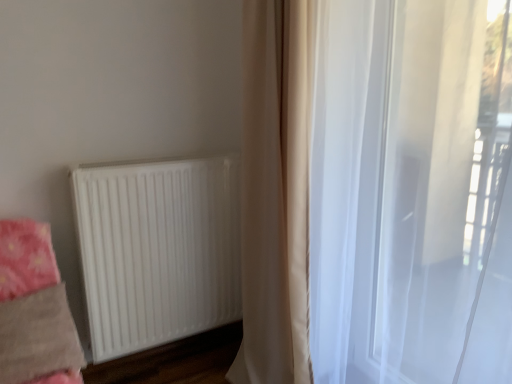
Question: From the image's perspective, is beige fabric curtain at center, placed as the 1th curtain when sorted from left to right, below translucent white curtain at right, acting as the 2th curtain starting from the left?

Choices:
 (A) yes
 (B) no

Answer: (B)

Question: Is beige fabric curtain at center, which appears as the second curtain when viewed from the right, positioned with its back to translucent white curtain at right, acting as the 2th curtain starting from the left?

Choices:
 (A) yes
 (B) no

Answer: (B)

Question: Considering the relative positions of beige fabric curtain at center, placed as the 1th curtain when sorted from left to right, and translucent white curtain at right, acting as the 2th curtain starting from the left, in the image provided, is beige fabric curtain at center, placed as the 1th curtain when sorted from left to right, behind translucent white curtain at right, acting as the 2th curtain starting from the left,?

Choices:
 (A) no
 (B) yes

Answer: (B)

Question: Does beige fabric curtain at center, which appears as the second curtain when viewed from the right, appear on the left side of translucent white curtain at right, which is counted as the first curtain, starting from the right?

Choices:
 (A) yes
 (B) no

Answer: (A)

Question: Is beige fabric curtain at center, placed as the 1th curtain when sorted from left to right, shorter than translucent white curtain at right, acting as the 2th curtain starting from the left?

Choices:
 (A) yes
 (B) no

Answer: (B)

Question: Is beige fabric curtain at center, placed as the 1th curtain when sorted from left to right, closer to the viewer compared to translucent white curtain at right, which is counted as the first curtain, starting from the right?

Choices:
 (A) no
 (B) yes

Answer: (A)

Question: Is white matte radiator at lower left positioned far away from fluffy pink blanket at lower left?

Choices:
 (A) yes
 (B) no

Answer: (B)

Question: From the image's perspective, would you say white matte radiator at lower left is shown under fluffy pink blanket at lower left?

Choices:
 (A) yes
 (B) no

Answer: (B)

Question: Can fluffy pink blanket at lower left be found inside white matte radiator at lower left?

Choices:
 (A) no
 (B) yes

Answer: (A)

Question: Can you confirm if white matte radiator at lower left is positioned to the left of fluffy pink blanket at lower left?

Choices:
 (A) no
 (B) yes

Answer: (A)

Question: Does white matte radiator at lower left come behind fluffy pink blanket at lower left?

Choices:
 (A) no
 (B) yes

Answer: (B)

Question: Is white matte radiator at lower left to the right of fluffy pink blanket at lower left from the viewer's perspective?

Choices:
 (A) yes
 (B) no

Answer: (A)

Question: Could you tell me if white matte radiator at lower left is turned towards beige fabric curtain at center, which appears as the second curtain when viewed from the right?

Choices:
 (A) yes
 (B) no

Answer: (A)